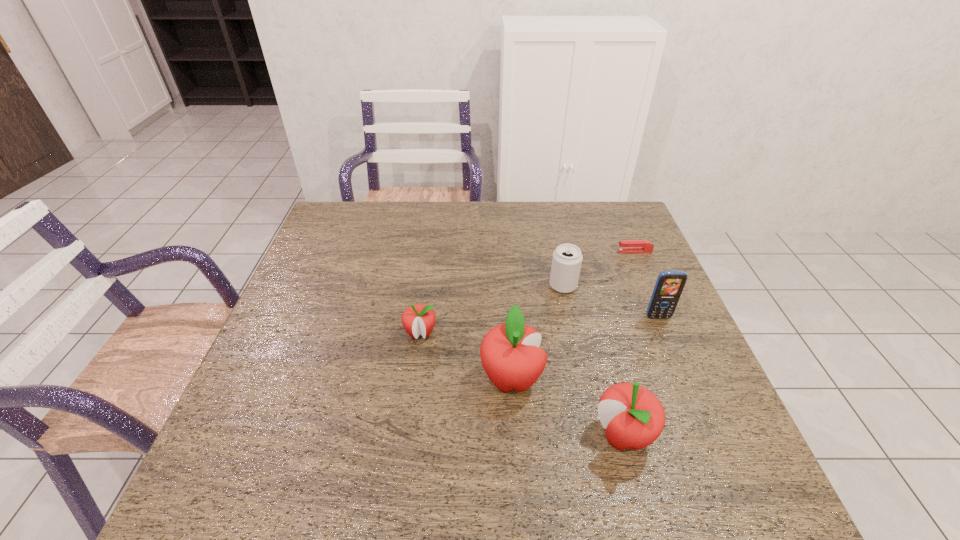
This screenshot has height=540, width=960. Find the location of `blank region between the leftmost object and the third shortest object`. blank region between the leftmost object and the third shortest object is located at coordinates (492, 309).

You are a GUI agent. You are given a task and a screenshot of the screen. Output one action in this format:
    pyautogui.click(x=<x>, y=<y>)
    Task: Click on the free space between the cellular telephone and the farthest apple
    The image size is (960, 540).
    Given the screenshot: What is the action you would take?
    pyautogui.click(x=540, y=325)

Where is `free space between the cellular telephone and the second object from left to right`? The height and width of the screenshot is (540, 960). free space between the cellular telephone and the second object from left to right is located at coordinates (585, 348).

I want to click on vacant area that lies between the third nearest object and the second nearest apple, so click(466, 356).

This screenshot has height=540, width=960. In order to click on free space between the farthest object and the third farthest object in this screenshot , I will do `click(646, 285)`.

Where is `unoccupied area between the leftmost apple and the third shortest object`? unoccupied area between the leftmost apple and the third shortest object is located at coordinates (492, 309).

Identify the location of empty location between the third nearest object and the second object from left to right. The width and height of the screenshot is (960, 540). (466, 356).

Identify the location of free point between the cellular telephone and the rightmost apple. The image size is (960, 540). (640, 376).

Locate an element on the screen. The image size is (960, 540). object that is the second closest to the can is located at coordinates (626, 246).

Locate which object is the second closest to the stapler. Please provide its 2D coordinates. Your answer should be formatted as a tuple, i.e. [(x, y)], where the tuple contains the x and y coordinates of a point satisfying the conditions above.

[(669, 285)]